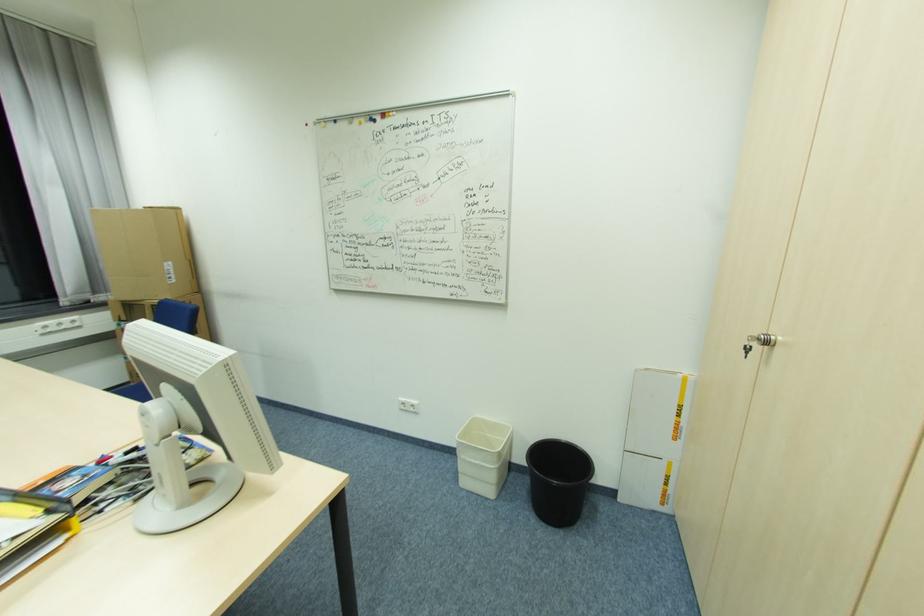
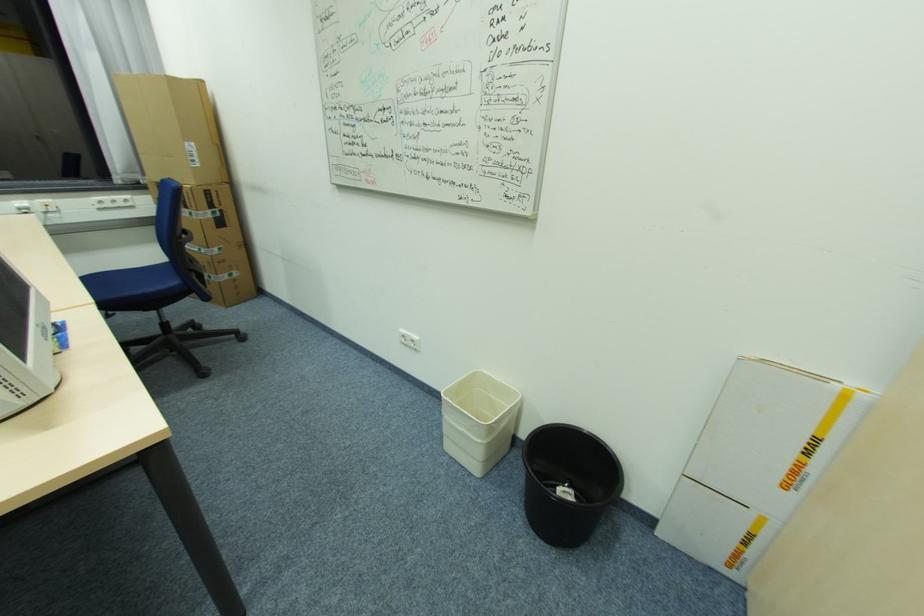
The point at (671,477) is marked in the first image. Where is the corresponding point in the second image?

(752, 535)